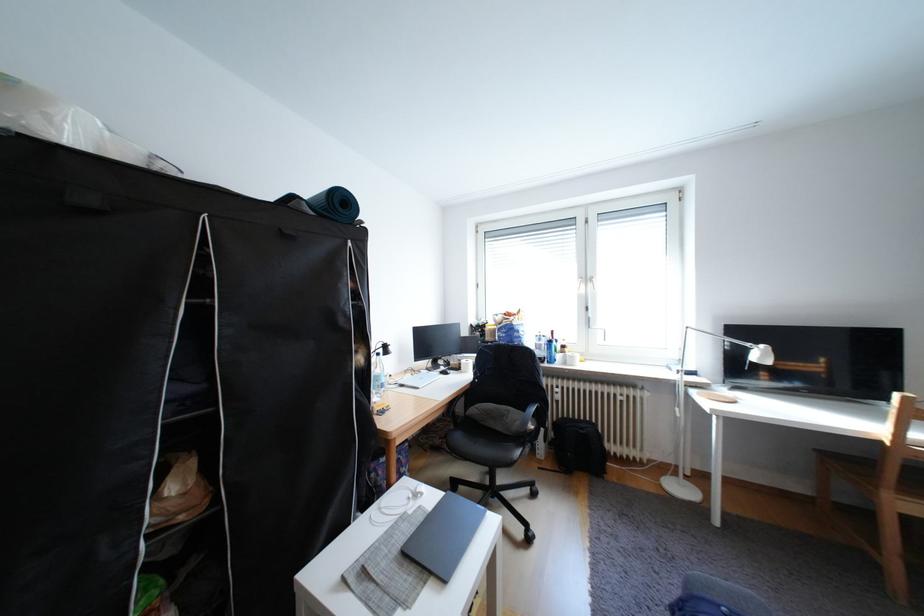
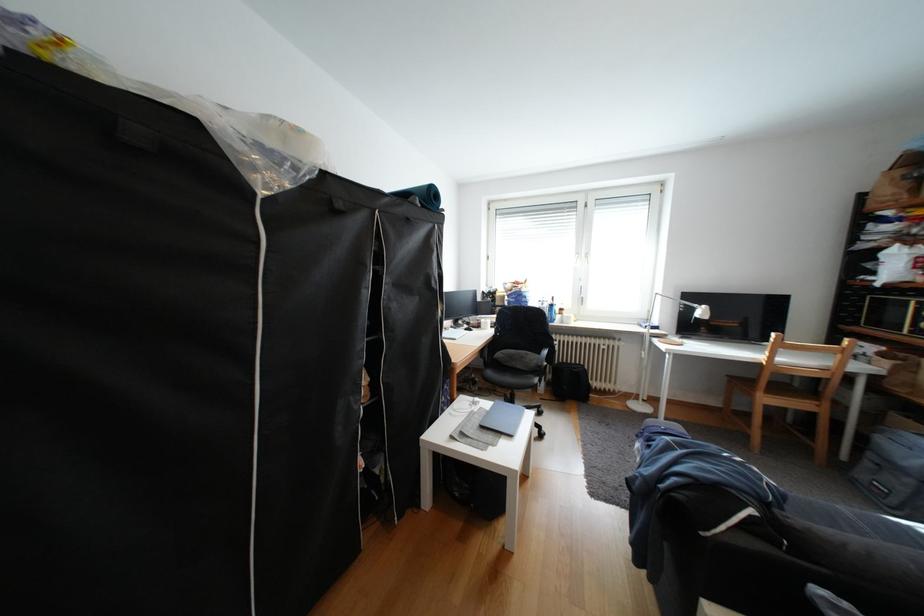
Find the pixel in the second image that matches [551,456] in the first image.

(552, 392)